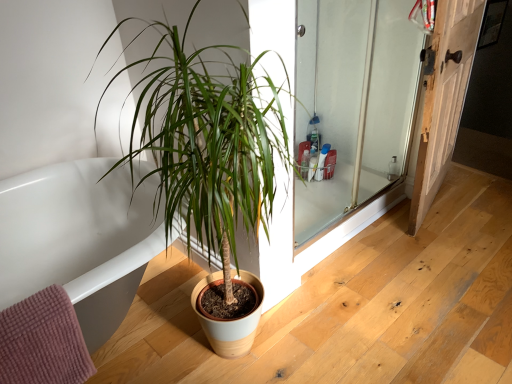
Where is `vacant space in clear glass screen door at right (from a real-world perspective)`? vacant space in clear glass screen door at right (from a real-world perspective) is located at coordinates (359, 218).